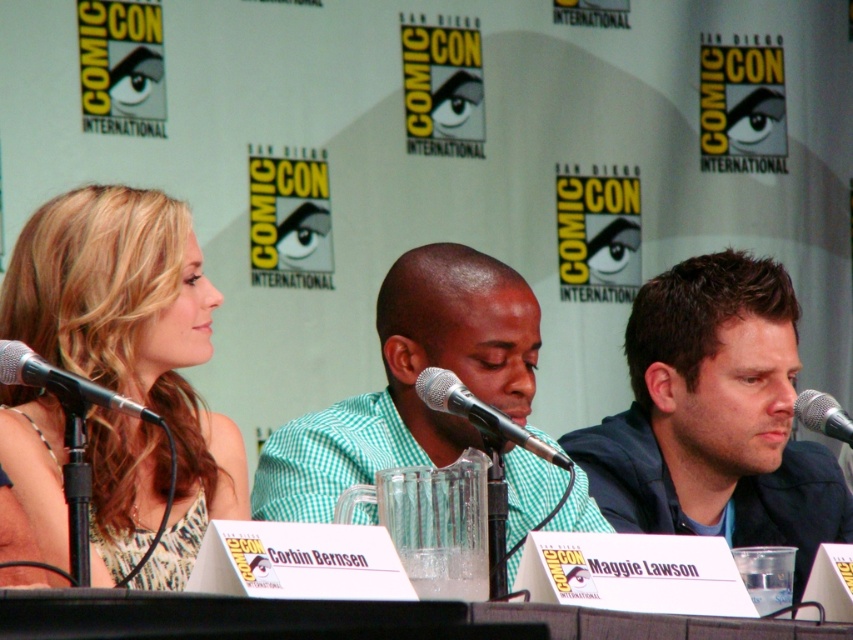
Question: Is blonde hair at center positioned before matte black microphone at left?

Choices:
 (A) yes
 (B) no

Answer: (B)

Question: Can you confirm if matte black microphone at left is wider than matte silver microphone at center?

Choices:
 (A) no
 (B) yes

Answer: (B)

Question: Which point is farther to the camera?

Choices:
 (A) (608, 433)
 (B) (19, 353)
 (C) (486, 353)

Answer: (A)

Question: Among these objects, which one is farthest from the camera?

Choices:
 (A) dark blue hoodie at center
 (B) matte black microphone at left

Answer: (A)

Question: Which object appears farthest from the camera in this image?

Choices:
 (A) matte black microphone at left
 (B) matte silver microphone at center

Answer: (B)

Question: Can you confirm if blonde hair at center is thinner than matte silver microphone at center?

Choices:
 (A) no
 (B) yes

Answer: (A)